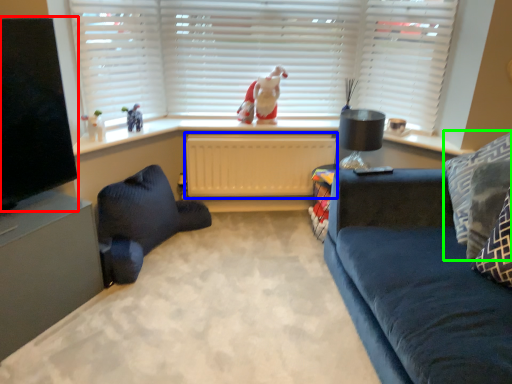
Question: Estimate the real-world distances between objects in this image. Which object is closer to window screen (highlighted by a red box), radiator (highlighted by a blue box) or pillow (highlighted by a green box)?

Choices:
 (A) radiator
 (B) pillow

Answer: (A)